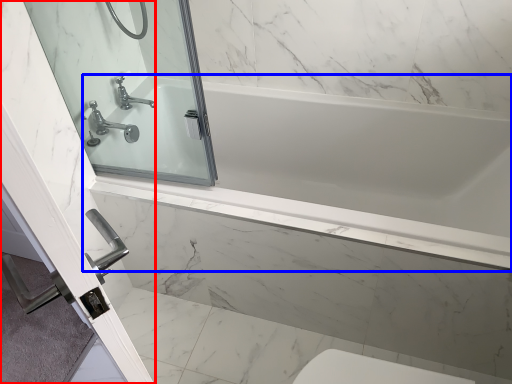
Question: Which object appears closest to the camera in this image, screen door (highlighted by a red box) or bathtub (highlighted by a blue box)?

Choices:
 (A) screen door
 (B) bathtub

Answer: (A)